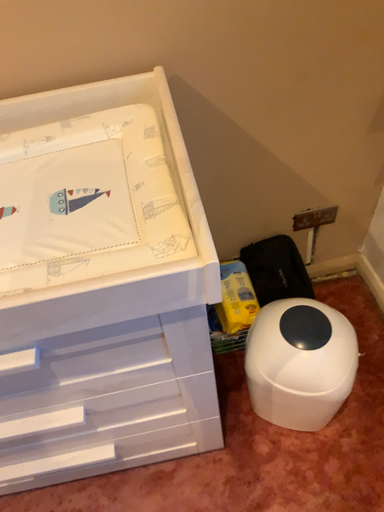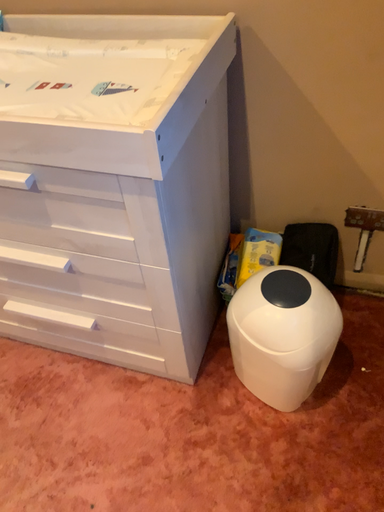
Question: Which way did the camera rotate in the video?

Choices:
 (A) rotated right
 (B) rotated left

Answer: (B)